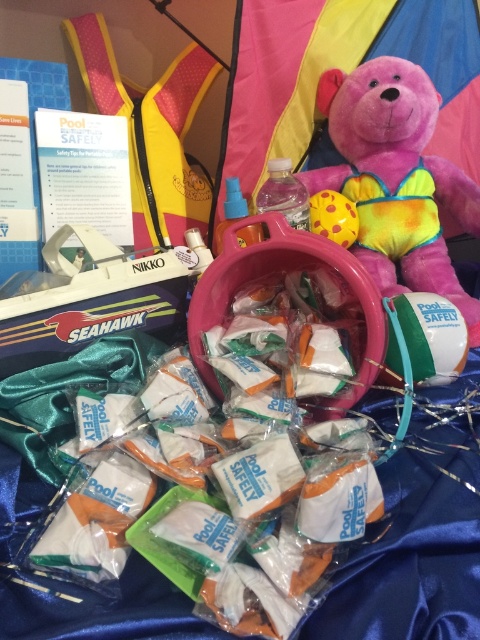
Question: Which point appears farthest from the camera in this image?

Choices:
 (A) (391, 243)
 (B) (334, 209)

Answer: (A)

Question: Can you confirm if pink plush bear at center is positioned to the left of yellow rubber ball at center?

Choices:
 (A) yes
 (B) no

Answer: (B)

Question: Which point is farther to the camera?

Choices:
 (A) white plastic bucket at center
 (B) yellow rubber ball at center

Answer: (B)

Question: Estimate the real-world distances between objects in this image. Which object is closer to the white plastic bucket at center?

Choices:
 (A) pink plush bear at center
 (B) yellow rubber ball at center

Answer: (B)

Question: Can you confirm if pink plush bear at center is positioned above yellow rubber ball at center?

Choices:
 (A) no
 (B) yes

Answer: (B)

Question: Can you confirm if pink plush bear at center is wider than yellow rubber ball at center?

Choices:
 (A) no
 (B) yes

Answer: (B)